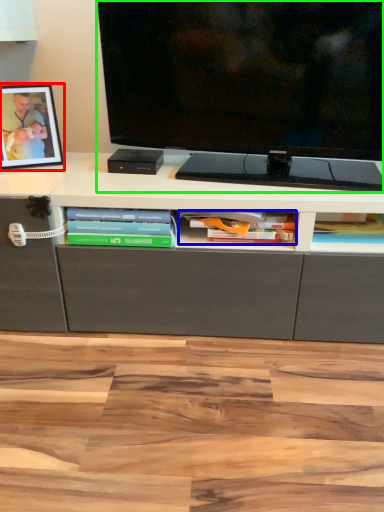
Question: Which object is the closest to the picture frame (highlighted by a red box)? Choose among these: book (highlighted by a blue box) or television (highlighted by a green box).

Choices:
 (A) book
 (B) television

Answer: (B)